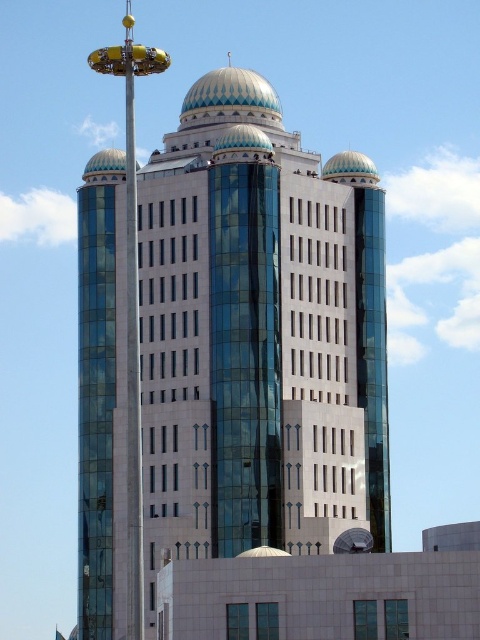
Between matte glass dome at center and metallic pole at center, which one appears on the right side from the viewer's perspective?

Positioned to the right is matte glass dome at center.

Between point (279, 188) and point (128, 86), which one is positioned in front?

Point (279, 188) is in front.

I want to click on matte glass dome at center, so click(x=257, y=346).

Between gold metallic dome at upper left and white glossy dome at center, which one has less height?

white glossy dome at center

Where is `gold metallic dome at upper left`? This screenshot has width=480, height=640. gold metallic dome at upper left is located at coordinates (105, 164).

Who is positioned more to the left, metallic pole at center or blue-green mosaic dome at center?

metallic pole at center

Does point (136, 451) lie behind point (252, 80)?

No.

Does point (137, 621) lie in front of point (255, 99)?

Yes.

At what (x,y) coordinates should I click in order to perform the action: click on metallic pole at center. Please return your answer as a coordinate pair (x, y). Image resolution: width=480 pixels, height=640 pixels. Looking at the image, I should click on (132, 349).